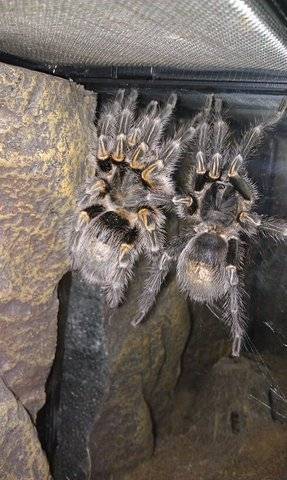
I want to click on ceiling, so click(x=104, y=28).